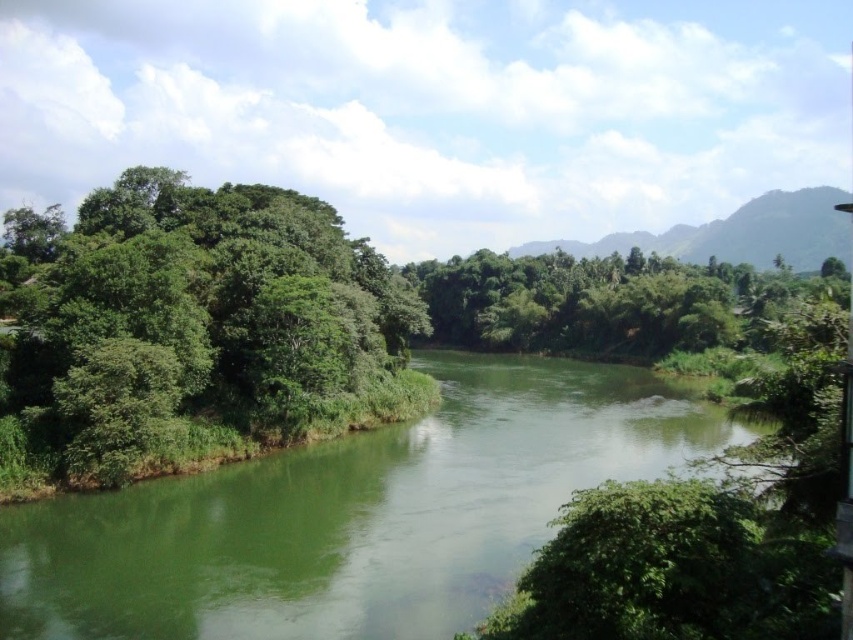
Who is higher up, green leafy trees at left or green leafy trees at center?

Positioned higher is green leafy trees at center.

Which is more to the left, green leafy trees at left or green leafy trees at center?

green leafy trees at left is more to the left.

Measure the distance between green leafy trees at left and camera.

green leafy trees at left is 103.45 feet from camera.

Where is `green leafy trees at left`? Image resolution: width=853 pixels, height=640 pixels. green leafy trees at left is located at coordinates (193, 332).

Does green smooth river at center come behind green leafy trees at center?

Yes, green smooth river at center is further from the viewer.

Looking at this image, who is positioned more to the right, green smooth river at center or green leafy trees at center?

green leafy trees at center is more to the right.

Between point (236, 557) and point (506, 310), which one is positioned behind?

The point (506, 310) is behind.

Identify the location of green smooth river at center. This screenshot has width=853, height=640. (354, 515).

Is green smooth river at center behind green leafy trees at left?

That is False.

Is green smooth river at center thinner than green leafy trees at left?

Yes.

Is point (90, 513) behind point (299, 396)?

No, (90, 513) is closer to viewer.

The image size is (853, 640). What are the coordinates of `green smooth river at center` in the screenshot? It's located at (354, 515).